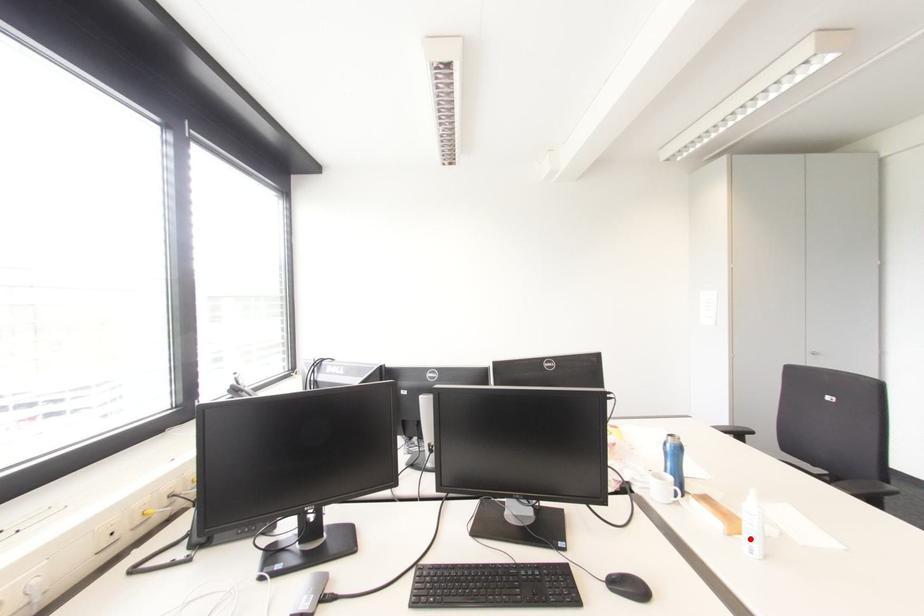
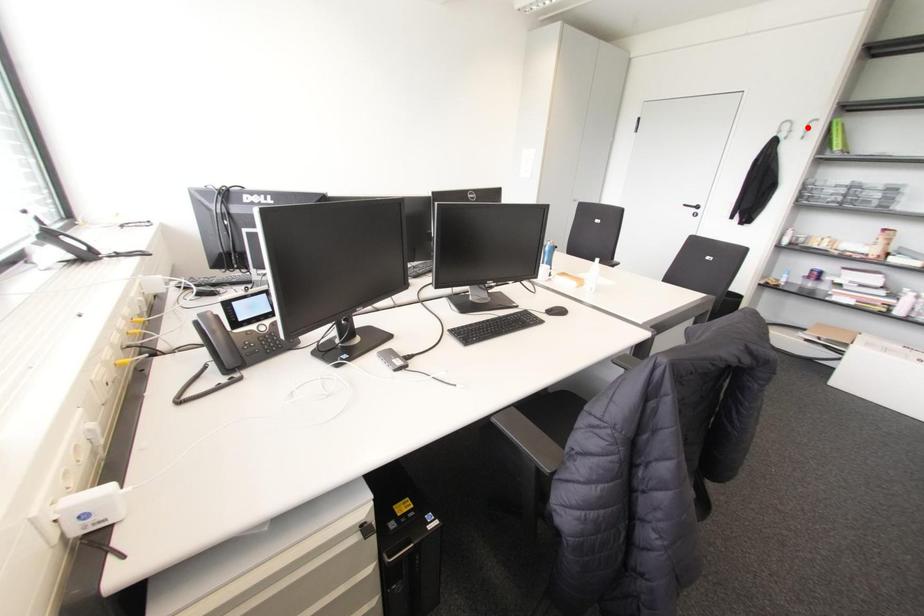
I am providing you with two images of the same scene from different viewpoints. A red point is marked on the first image and another point is marked on the second image. Does the point marked in image1 correspond to the same location as the one in image2?

No